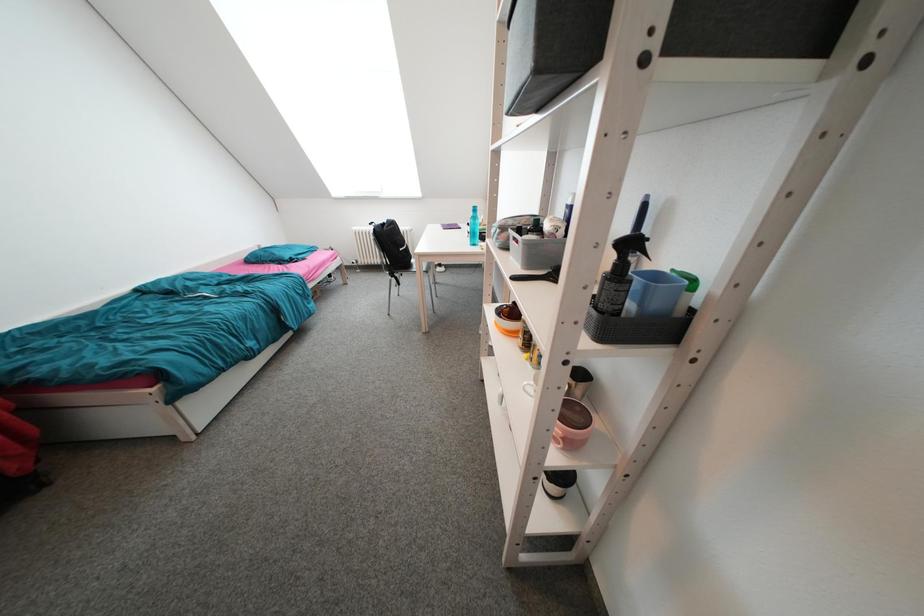
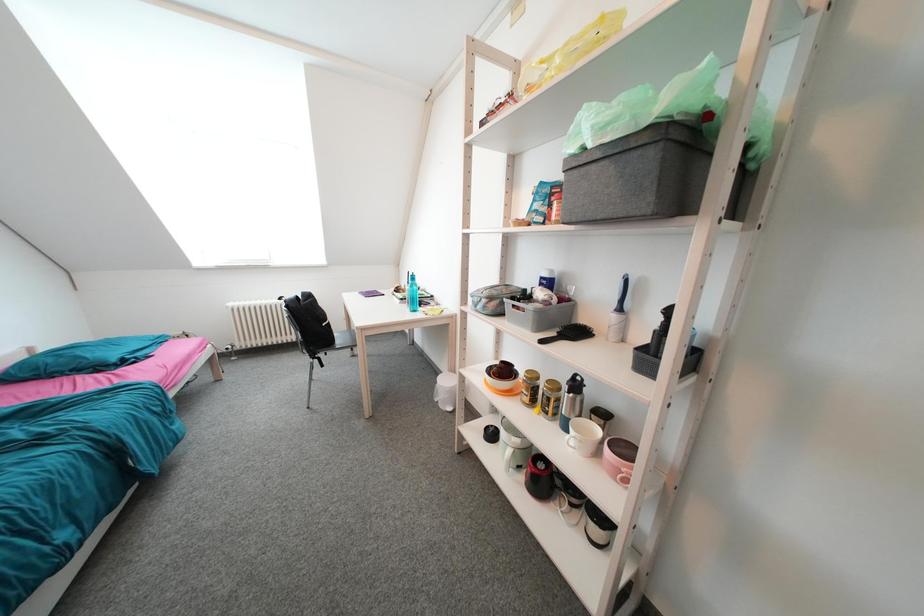
Question: Based on the continuous images, in which direction is the camera rotating? Reply with the corresponding letter.

Choices:
 (A) Left
 (B) Right
 (C) Up
 (D) Down

Answer: (B)